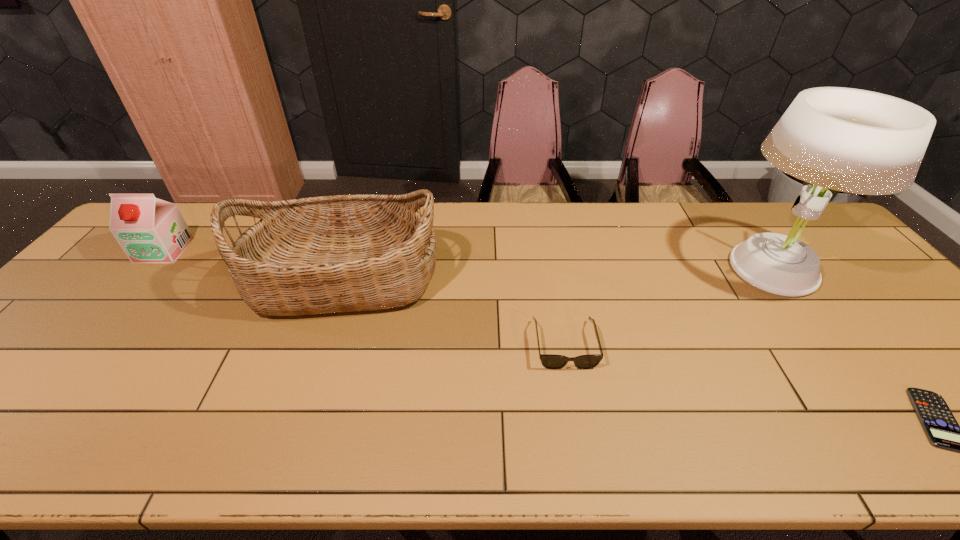
This screenshot has height=540, width=960. Find the location of `free space at the left edge of the desktop`. free space at the left edge of the desktop is located at coordinates (27, 392).

Locate an element on the screen. blank area at the right edge is located at coordinates (843, 275).

This screenshot has height=540, width=960. What are the coordinates of `vacant space at the far right corner of the desktop` in the screenshot? It's located at (780, 207).

Where is `vacant space in between the tallest object and the leftmost object`? The image size is (960, 540). vacant space in between the tallest object and the leftmost object is located at coordinates (468, 260).

Find the location of a particular element. The width and height of the screenshot is (960, 540). free point between the lamp and the second tallest object is located at coordinates (558, 275).

At what (x,y) coordinates should I click in order to perform the action: click on vacant point located between the tallest object and the third tallest object. Please return your answer as a coordinate pair (x, y). The height and width of the screenshot is (540, 960). Looking at the image, I should click on (468, 260).

Where is `vacant point located between the third object from right to left and the fourth object from right to left`? vacant point located between the third object from right to left and the fourth object from right to left is located at coordinates (455, 312).

The image size is (960, 540). What are the coordinates of `object identified as the fourth closest to the third object from right to left` in the screenshot? It's located at (149, 230).

Point out which object is positioned as the fourth nearest to the sunglasses. Please provide its 2D coordinates. Your answer should be formatted as a tuple, i.e. [(x, y)], where the tuple contains the x and y coordinates of a point satisfying the conditions above.

[(149, 230)]